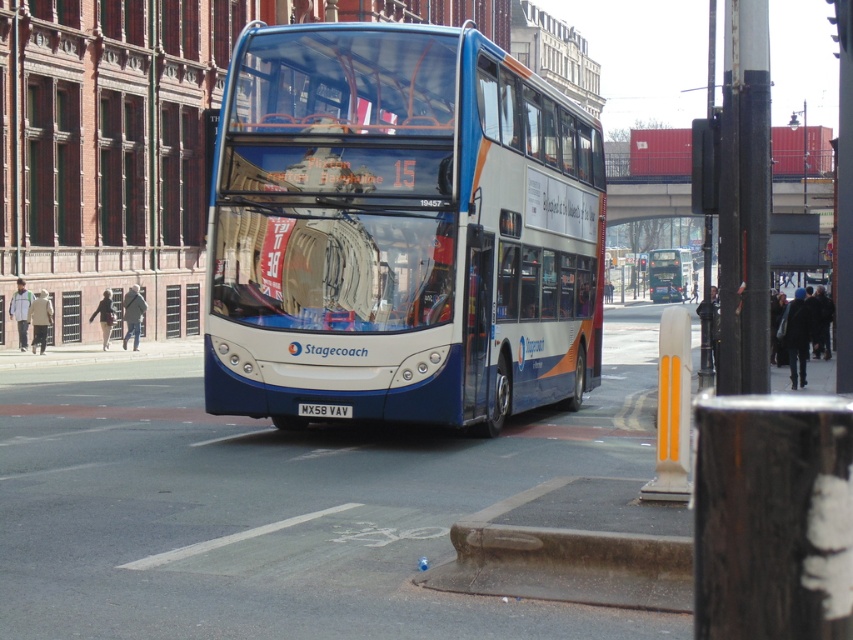
Question: Is blue metallic bus at center above white glossy bus at center?

Choices:
 (A) yes
 (B) no

Answer: (B)

Question: Based on their relative distances, which object is farther from the blue metallic bus at center?

Choices:
 (A) white glossy bus at center
 (B) black plastic license plate at center

Answer: (A)

Question: Which point is farther from the camera taking this photo?

Choices:
 (A) (445, 129)
 (B) (664, 291)

Answer: (B)

Question: Does blue metallic bus at center have a larger size compared to white glossy bus at center?

Choices:
 (A) no
 (B) yes

Answer: (A)

Question: Can you confirm if blue metallic bus at center is positioned to the left of white glossy bus at center?

Choices:
 (A) no
 (B) yes

Answer: (B)

Question: Which of the following is the closest to the observer?

Choices:
 (A) black plastic license plate at center
 (B) white glossy bus at center

Answer: (A)